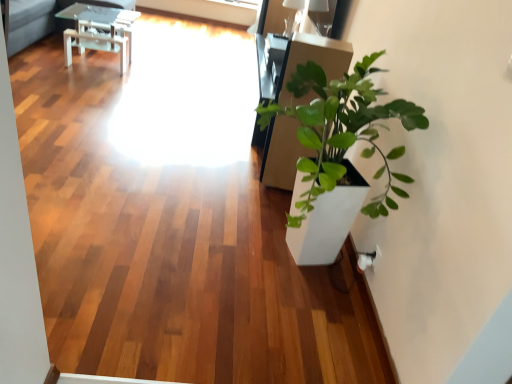
At what (x,y) coordinates should I click in order to perform the action: click on white glossy table at upper left. Please return your answer as a coordinate pair (x, y). Image resolution: width=512 pixels, height=384 pixels. Looking at the image, I should click on (99, 30).

In order to face white glossy table at upper left, should I rotate leftwards or rightwards?

Turn left by 20.048 degrees to look at white glossy table at upper left.

What do you see at coordinates (99, 30) in the screenshot?
I see `white glossy table at upper left` at bounding box center [99, 30].

Locate an element on the screen. The image size is (512, 384). translucent glass window screen at upper center is located at coordinates (208, 9).

The width and height of the screenshot is (512, 384). Describe the element at coordinates (208, 9) in the screenshot. I see `translucent glass window screen at upper center` at that location.

This screenshot has width=512, height=384. Identify the location of white glossy table at upper left. (99, 30).

Between white glossy table at upper left and translucent glass window screen at upper center, which one appears on the right side from the viewer's perspective?

Positioned to the right is translucent glass window screen at upper center.

Between white glossy table at upper left and translucent glass window screen at upper center, which one is positioned in front?

white glossy table at upper left is more forward.

Considering the positions of points (113, 49) and (149, 8), is point (113, 49) closer to camera compared to point (149, 8)?

That is True.

From the image's perspective, does white glossy table at upper left appear lower than translucent glass window screen at upper center?

Yes, from the image's perspective, white glossy table at upper left is below translucent glass window screen at upper center.

From a real-world perspective, relative to translucent glass window screen at upper center, is white glossy table at upper left vertically above or below?

Clearly, from a real-world perspective, white glossy table at upper left is above translucent glass window screen at upper center.

Considering the relative sizes of white glossy table at upper left and translucent glass window screen at upper center in the image provided, is white glossy table at upper left thinner than translucent glass window screen at upper center?

In fact, white glossy table at upper left might be wider than translucent glass window screen at upper center.

Which of these two, white glossy table at upper left or translucent glass window screen at upper center, stands taller?

Standing taller between the two is white glossy table at upper left.

Which of these two, white glossy table at upper left or translucent glass window screen at upper center, is bigger?

Bigger between the two is white glossy table at upper left.

Is white glossy table at upper left not within translucent glass window screen at upper center?

Indeed, white glossy table at upper left is completely outside translucent glass window screen at upper center.

Is the surface of white glossy table at upper left in direct contact with translucent glass window screen at upper center?

white glossy table at upper left and translucent glass window screen at upper center are clearly separated.

Does white glossy table at upper left turn towards translucent glass window screen at upper center?

No, white glossy table at upper left is not facing towards translucent glass window screen at upper center.

How different are the orientations of white glossy table at upper left and translucent glass window screen at upper center in degrees?

The angular difference between white glossy table at upper left and translucent glass window screen at upper center is 89.8 degrees.

How much distance is there between white glossy table at upper left and translucent glass window screen at upper center?

The distance of white glossy table at upper left from translucent glass window screen at upper center is 6.88 feet.

Image resolution: width=512 pixels, height=384 pixels. What are the coordinates of `table below the translucent glass window screen at upper center (from the image's perspective)` in the screenshot? It's located at (99, 30).

In the scene shown: Between translucent glass window screen at upper center and white glossy table at upper left, which one appears on the left side from the viewer's perspective?

white glossy table at upper left is more to the left.

Is the depth of translucent glass window screen at upper center greater than that of white glossy table at upper left?

Yes, it is.

Is point (248, 20) behind point (111, 9)?

Yes.

From the image's perspective, is translucent glass window screen at upper center above white glossy table at upper left?

Yes, from the image's perspective, translucent glass window screen at upper center is above white glossy table at upper left.

From a real-world perspective, is translucent glass window screen at upper center positioned over white glossy table at upper left based on gravity?

Actually, translucent glass window screen at upper center is physically below white glossy table at upper left in the real world.

Is translucent glass window screen at upper center wider or thinner than white glossy table at upper left?

translucent glass window screen at upper center is thinner than white glossy table at upper left.

Is translucent glass window screen at upper center taller than white glossy table at upper left?

In fact, translucent glass window screen at upper center may be shorter than white glossy table at upper left.

Based on their sizes in the image, would you say translucent glass window screen at upper center is bigger or smaller than white glossy table at upper left?

Considering their sizes, translucent glass window screen at upper center takes up less space than white glossy table at upper left.

Is white glossy table at upper left inside translucent glass window screen at upper center?

No, white glossy table at upper left is not surrounded by translucent glass window screen at upper center.

Is translucent glass window screen at upper center positioned far away from white glossy table at upper left?

translucent glass window screen at upper center is positioned a significant distance from white glossy table at upper left.

Is translucent glass window screen at upper center turned away from white glossy table at upper left?

That's not correct — translucent glass window screen at upper center is not looking away from white glossy table at upper left.

Locate an element on the screen. table positioned vertically above the translucent glass window screen at upper center (from a real-world perspective) is located at coordinates (99, 30).

At what (x,y) coordinates should I click in order to perform the action: click on window screen below the white glossy table at upper left (from a real-world perspective). Please return your answer as a coordinate pair (x, y). Looking at the image, I should click on (208, 9).

Locate an element on the screen. window screen on the right of white glossy table at upper left is located at coordinates (208, 9).